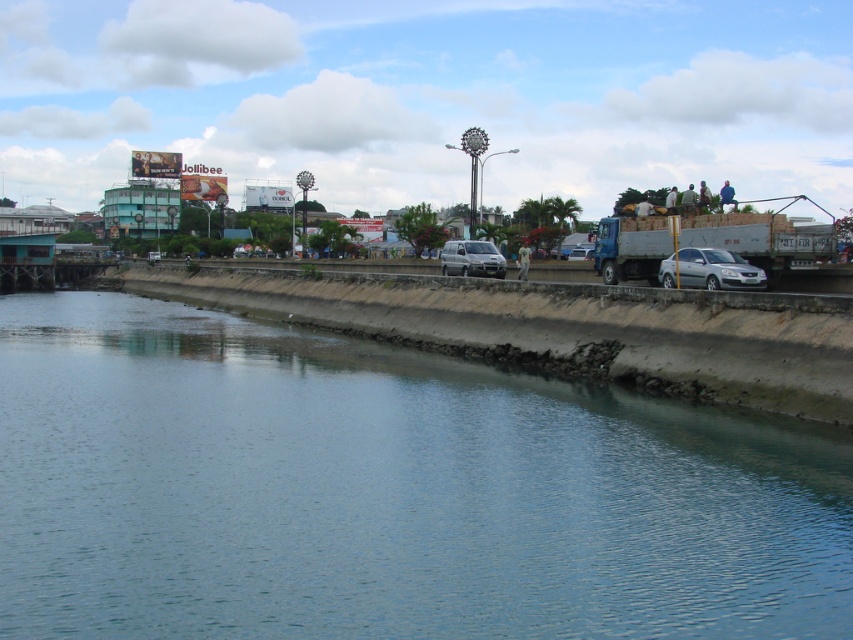
Question: Is clear water at lower left below satin silver van at center?

Choices:
 (A) yes
 (B) no

Answer: (A)

Question: Which point is closer to the camera?

Choices:
 (A) silver metallic sedan at center
 (B) satin silver van at center
 (C) clear water at lower left
 (D) matte silver van at center

Answer: (C)

Question: Which object appears closest to the camera in this image?

Choices:
 (A) silver metallic sedan at center
 (B) clear water at lower left
 (C) satin silver van at center

Answer: (B)

Question: Which point is closer to the camera?

Choices:
 (A) satin silver van at center
 (B) clear water at lower left

Answer: (B)

Question: Can you confirm if silver metallic sedan at center is wider than satin silver van at center?

Choices:
 (A) no
 (B) yes

Answer: (A)

Question: Does satin silver van at center appear on the left side of matte silver van at center?

Choices:
 (A) yes
 (B) no

Answer: (A)